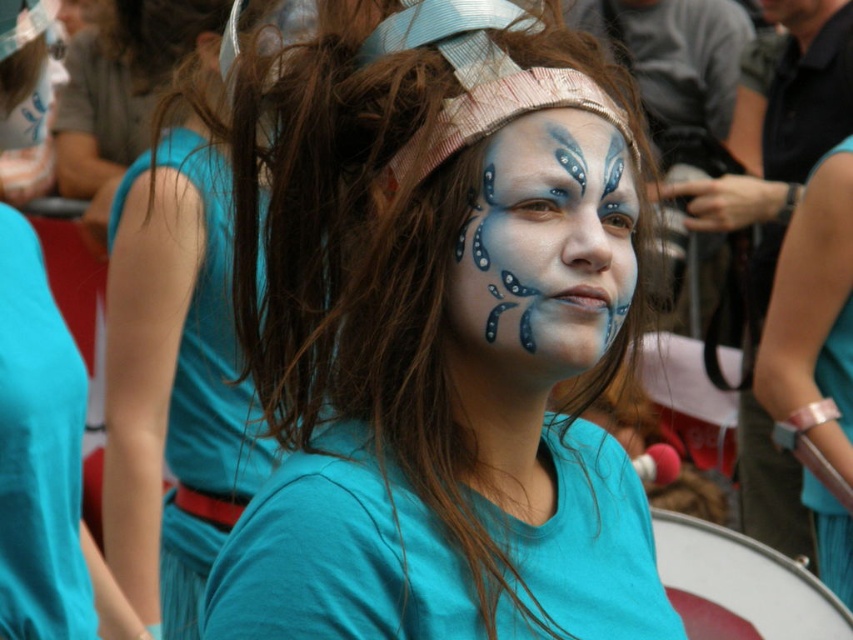
Question: Where is matte blue face paint at center located in relation to matte blue paint at center in the image?

Choices:
 (A) right
 (B) left

Answer: (B)

Question: Which point is closer to the camera taking this photo?

Choices:
 (A) (585, 369)
 (B) (454, 529)
 (C) (198, 168)
 (D) (1, 522)

Answer: (B)

Question: Does turquoise fabric dress at left appear under matte blue paint at center?

Choices:
 (A) yes
 (B) no

Answer: (A)

Question: Which of the following is the closest to the observer?

Choices:
 (A) matte blue paint at center
 (B) white drum at lower right
 (C) teal fabric dress at left

Answer: (A)

Question: Which of the following is the closest to the observer?

Choices:
 (A) matte blue paint at center
 (B) turquoise fabric dress at left
 (C) teal fabric dress at left

Answer: (A)

Question: Does matte blue paint at center appear under teal fabric dress at left?

Choices:
 (A) no
 (B) yes

Answer: (A)